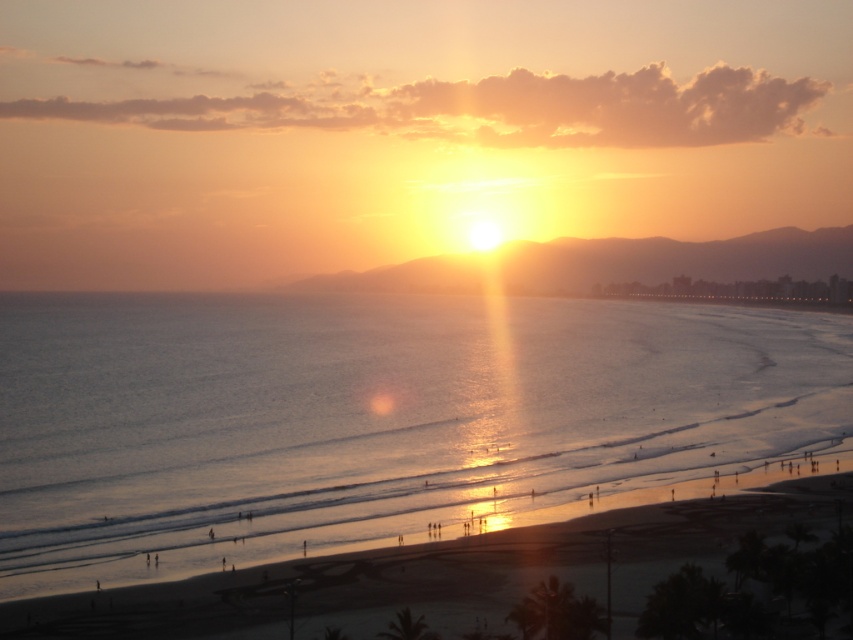
Is shiny blue water at center positioned in front of sandy beach at lower center?

That is False.

Which is more to the right, shiny blue water at center or sandy beach at lower center?

sandy beach at lower center is more to the right.

Is point (279, 321) in front of point (155, 582)?

No.

Identify the location of shiny blue water at center. The height and width of the screenshot is (640, 853). (369, 417).